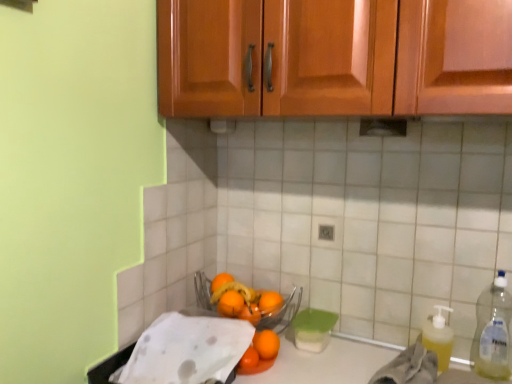
Question: Could you tell me if clear plastic bottle at right is turned towards orange matte at center, which is the second orange from front to back?

Choices:
 (A) yes
 (B) no

Answer: (B)

Question: Is the position of clear plastic bottle at right less distant than that of orange matte at center, which is the second orange from front to back?

Choices:
 (A) no
 (B) yes

Answer: (B)

Question: Does clear plastic bottle at right have a smaller size compared to orange matte at center, which is the second orange from front to back?

Choices:
 (A) yes
 (B) no

Answer: (B)

Question: Is clear plastic bottle at right bigger than orange matte at center, the 4th orange in the back-to-front sequence?

Choices:
 (A) no
 (B) yes

Answer: (B)

Question: Is clear plastic bottle at right wider than orange matte at center, the 4th orange in the back-to-front sequence?

Choices:
 (A) no
 (B) yes

Answer: (B)

Question: From the image's perspective, would you say clear plastic bottle at right is positioned over orange matte at center, the 4th orange in the back-to-front sequence?

Choices:
 (A) yes
 (B) no

Answer: (B)

Question: From the image's perspective, is yellow translucent liquid at lower right, positioned as the 2th material in left-to-right order, on orange matte at center, the 5th orange from the back?

Choices:
 (A) yes
 (B) no

Answer: (B)

Question: Could you tell me if yellow translucent liquid at lower right, positioned as the first material in right-to-left order, is facing orange matte at center, which is the 1th orange in front-to-back order?

Choices:
 (A) no
 (B) yes

Answer: (A)

Question: Is yellow translucent liquid at lower right, positioned as the first material in right-to-left order, positioned before orange matte at center, which is the 1th orange in front-to-back order?

Choices:
 (A) yes
 (B) no

Answer: (A)

Question: Is yellow translucent liquid at lower right, positioned as the first material in right-to-left order, outside of orange matte at center, the 5th orange from the back?

Choices:
 (A) yes
 (B) no

Answer: (A)

Question: Considering the relative sizes of yellow translucent liquid at lower right, positioned as the 2th material in left-to-right order, and orange matte at center, the 5th orange from the back, in the image provided, is yellow translucent liquid at lower right, positioned as the 2th material in left-to-right order, smaller than orange matte at center, the 5th orange from the back,?

Choices:
 (A) no
 (B) yes

Answer: (A)

Question: From a real-world perspective, is yellow translucent liquid at lower right, positioned as the 2th material in left-to-right order, beneath orange matte at center, which is the 1th orange in front-to-back order?

Choices:
 (A) yes
 (B) no

Answer: (B)

Question: Does orange matte at center, the 4th orange in the front-to-back sequence, lie behind clear plastic bottle at right?

Choices:
 (A) yes
 (B) no

Answer: (A)